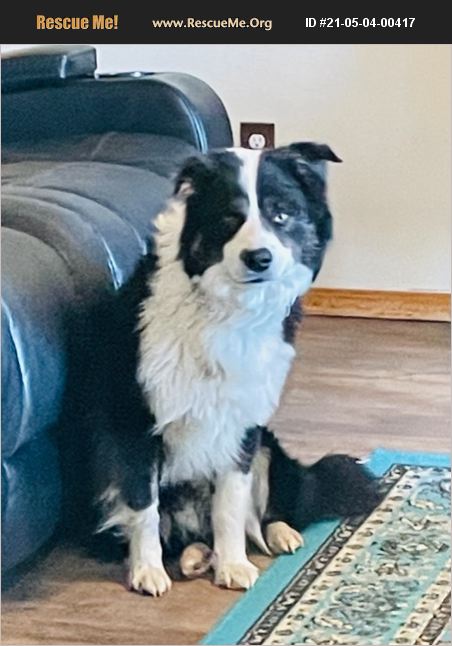
In order to click on wall in this screenshot , I will do `click(406, 216)`.